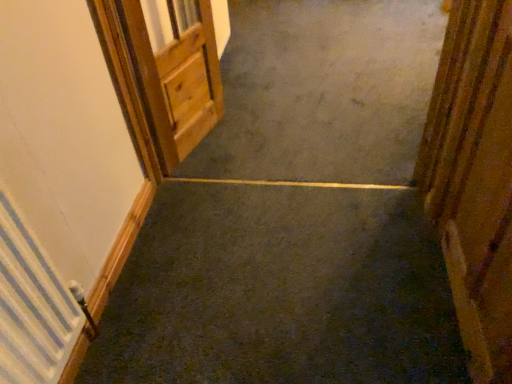
Question: Is wooden door at upper left, arranged as the 1th door when viewed from the left, positioned with its back to smooth concrete at center?

Choices:
 (A) yes
 (B) no

Answer: (B)

Question: Considering the relative positions of wooden door at upper left, placed as the 2th door when sorted from front to back, and smooth concrete at center in the image provided, is wooden door at upper left, placed as the 2th door when sorted from front to back, behind smooth concrete at center?

Choices:
 (A) yes
 (B) no

Answer: (B)

Question: Is wooden door at upper left, placed as the 2th door when sorted from front to back, smaller than smooth concrete at center?

Choices:
 (A) yes
 (B) no

Answer: (A)

Question: From a real-world perspective, is wooden door at upper left, arranged as the 1th door when viewed from the left, below smooth concrete at center?

Choices:
 (A) yes
 (B) no

Answer: (B)

Question: Does wooden door at upper left, marked as the first door in a back-to-front arrangement, have a lesser width compared to smooth concrete at center?

Choices:
 (A) no
 (B) yes

Answer: (B)

Question: From a real-world perspective, does wooden door at upper left, arranged as the 1th door when viewed from the left, stand above smooth concrete at center?

Choices:
 (A) yes
 (B) no

Answer: (A)

Question: Is wooden door at upper left, the 2th door in the right-to-left sequence, in contact with white textured radiator at left?

Choices:
 (A) no
 (B) yes

Answer: (A)

Question: From the image's perspective, does wooden door at upper left, arranged as the 1th door when viewed from the left, appear higher than white textured radiator at left?

Choices:
 (A) no
 (B) yes

Answer: (B)

Question: Is wooden door at upper left, the 2th door in the right-to-left sequence, facing away from white textured radiator at left?

Choices:
 (A) no
 (B) yes

Answer: (A)

Question: Is wooden door at upper left, arranged as the 1th door when viewed from the left, to the left of white textured radiator at left from the viewer's perspective?

Choices:
 (A) no
 (B) yes

Answer: (A)

Question: Would you say wooden door at upper left, arranged as the 1th door when viewed from the left, contains white textured radiator at left?

Choices:
 (A) yes
 (B) no

Answer: (B)

Question: Is wooden door at upper left, the 2th door in the right-to-left sequence, closer to camera compared to white textured radiator at left?

Choices:
 (A) no
 (B) yes

Answer: (A)

Question: Is wooden door at upper left, arranged as the 1th door when viewed from the left, positioned in front of wooden door at right, marked as the first door in a right-to-left arrangement?

Choices:
 (A) no
 (B) yes

Answer: (A)